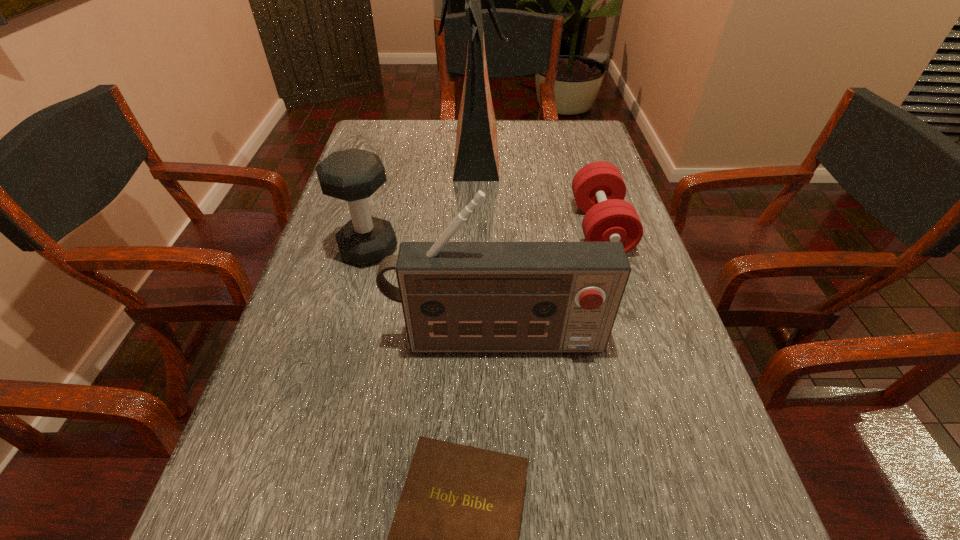
Where is `the farthest object`? This screenshot has width=960, height=540. the farthest object is located at coordinates (476, 153).

Locate an element on the screen. The image size is (960, 540). the tallest object is located at coordinates (476, 153).

Locate an element on the screen. The height and width of the screenshot is (540, 960). the second nearest object is located at coordinates (456, 296).

At what (x,y) coordinates should I click in order to perform the action: click on radio receiver. Please return your answer as a coordinate pair (x, y). Looking at the image, I should click on (456, 296).

Image resolution: width=960 pixels, height=540 pixels. What are the coordinates of `the third tallest object` in the screenshot? It's located at (353, 175).

The width and height of the screenshot is (960, 540). Identify the location of the leftmost object. pos(353,175).

Locate an element on the screen. The height and width of the screenshot is (540, 960). the shorter dumbbell is located at coordinates (599, 190).

The width and height of the screenshot is (960, 540). What are the coordinates of `the right dumbbell` in the screenshot? It's located at (599, 190).

Where is `vacant space located 0.070m on the front side of the tallest object`? vacant space located 0.070m on the front side of the tallest object is located at coordinates (529, 154).

The image size is (960, 540). I want to click on free point located on the front panel of the fourth farthest object, so 499,421.